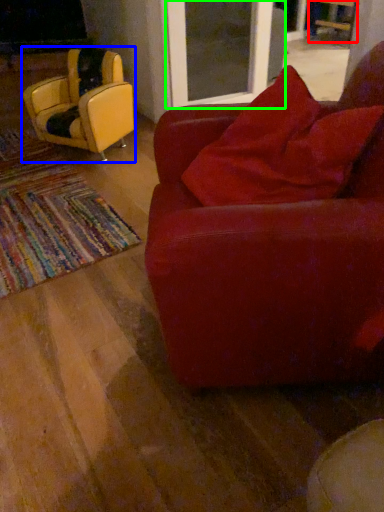
Question: Estimate the real-world distances between objects in this image. Which object is closer to chair (highlighted by a red box), chair (highlighted by a blue box) or screen door (highlighted by a green box)?

Choices:
 (A) chair
 (B) screen door

Answer: (B)